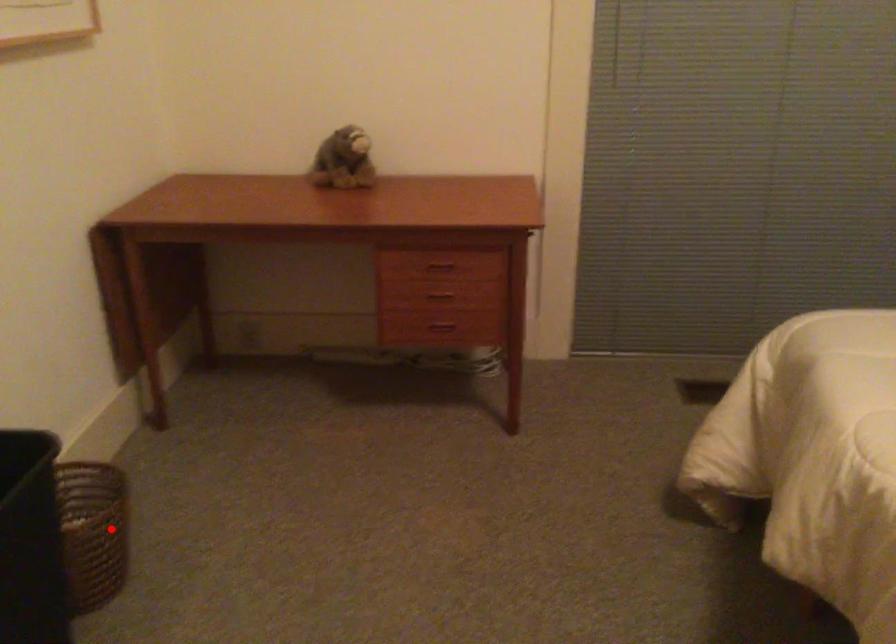
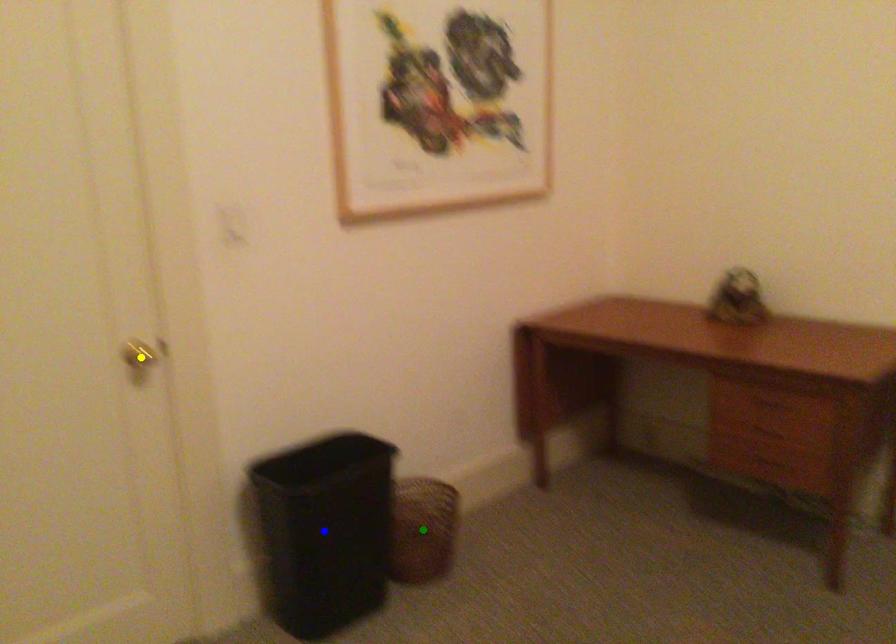
Question: I am providing you with two images of the same scene from different viewpoints. A red point is marked on the first image. You are given multiple points on the second image. In image 2, which mark is for the same physical point as the one in image 1?

Choices:
 (A) green point
 (B) yellow point
 (C) blue point

Answer: (A)